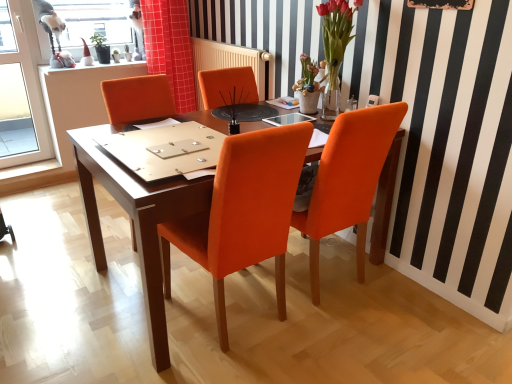
Question: Considering the positions of point (275, 117) and point (158, 26), is point (275, 117) closer or farther from the camera than point (158, 26)?

Choices:
 (A) closer
 (B) farther

Answer: (A)

Question: Considering the positions of transparent glass table at center and red checkered fabric at upper center in the image, is transparent glass table at center wider or thinner than red checkered fabric at upper center?

Choices:
 (A) thin
 (B) wide

Answer: (A)

Question: Which object is the closest to the wooden bulletin board at upper center?

Choices:
 (A) red checkered fabric at upper center
 (B) orange leather chair at center, which appears as the second chair when viewed from the left
 (C) orange leather chair at center, which is the 1th chair from left to right
 (D) transparent glass table at center
 (E) matte wood desk at center

Answer: (D)

Question: Which object is positioned closest to the translucent glass vase at upper right?

Choices:
 (A) transparent glass table at center
 (B) matte wood desk at center
 (C) orange leather chair at center, which ranks as the 2th chair in right-to-left order
 (D) red checkered fabric at upper center
 (E) wooden bulletin board at upper center

Answer: (A)